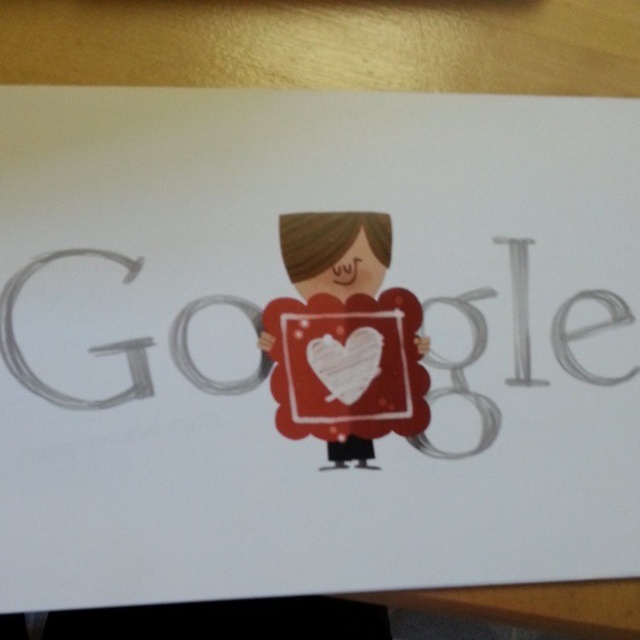
You are designing a sticker that needs to fit within a square frame. The frame has a width equal to the height of the matte paper girl at center. Will the matte gray google at center fit inside this frame without overlapping the edges?

The matte gray google at center might be wider than the matte paper girl at center, so it may not fit inside the frame designed to match the girl

Based on the photo, you are designing a Valentine card and see the image with the matte gray google at center and the matte paper girl at center. Which object is placed higher in the image?

The matte paper girl at center is placed higher because the matte gray google at center is positioned under it.